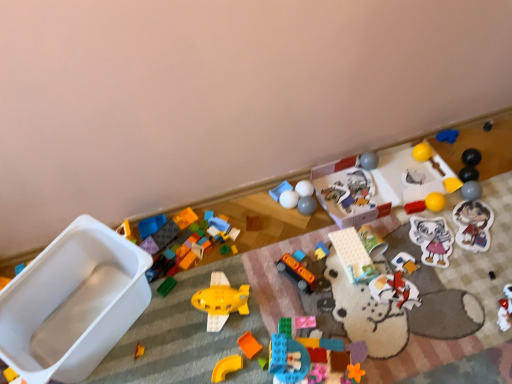
Locate an element on the screen. This screenshot has height=384, width=512. vacant area that lies in front of yellow plastic airplane at center, placed as the fourth toy when sorted from left to right is located at coordinates 220,359.